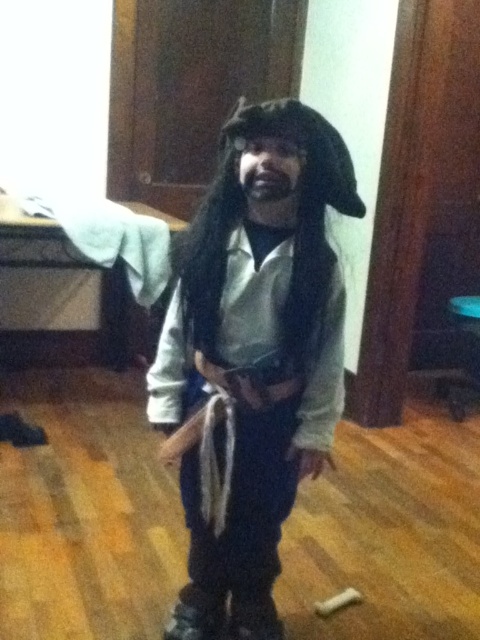
Does white matte pirate costume at center lie in front of dark brown hair at center?

That is False.

Is the position of white matte pirate costume at center more distant than that of dark brown hair at center?

Yes, white matte pirate costume at center is further from the viewer.

Is point (299, 236) behind point (262, 180)?

Yes, it is.

This screenshot has height=640, width=480. I want to click on white matte pirate costume at center, so click(x=253, y=362).